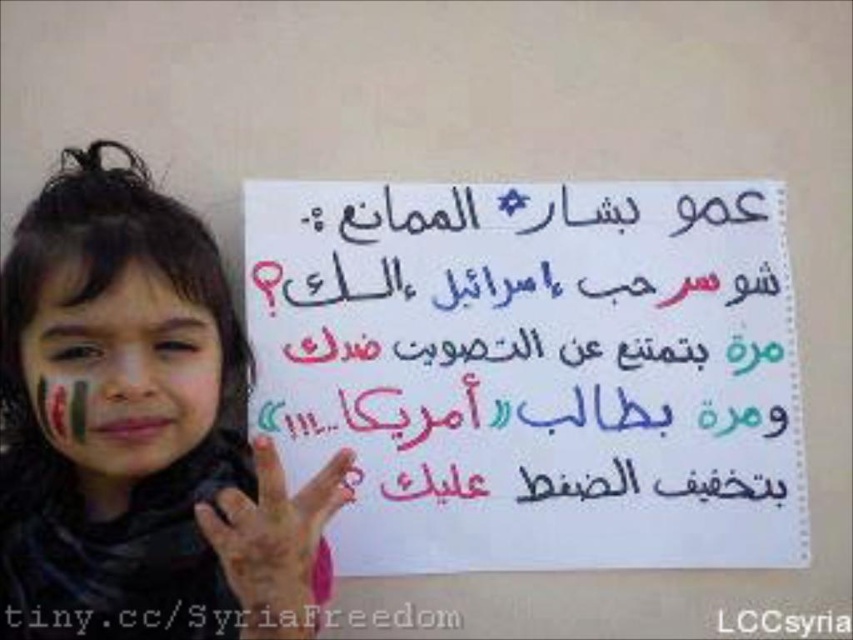
The scene shows a young girl holding a sign. You are an observer trying to understand the composition of the image. Which object is located to the right of the other between the matte black scarf at center and the matte plastic face at center?

The matte black scarf at center is positioned on the right side of matte plastic face at center.

You are an art student analyzing the composition of this image. You notice two points in the image at coordinates point (144, 275) and point (268, 557). Based on their positions, which point is closer to the viewer?

Point (144, 275) is closer to the viewer than point (268, 557) because it is further to the viewer according to the description.

You are an artist trying to replicate this scene. You want to paint the matte plastic face at center and the pink matte hand at center. According to the image, which object should you paint first if you start from the bottom and work upwards?

The pink matte hand at center should be painted first because it is below the matte plastic face at center.